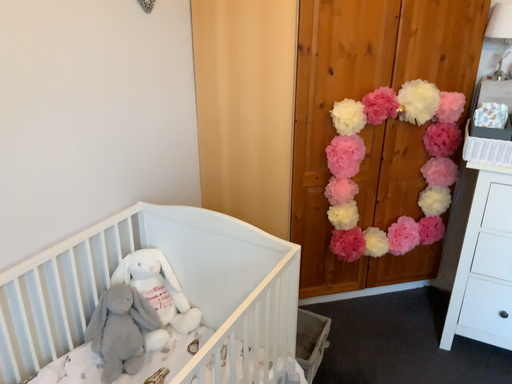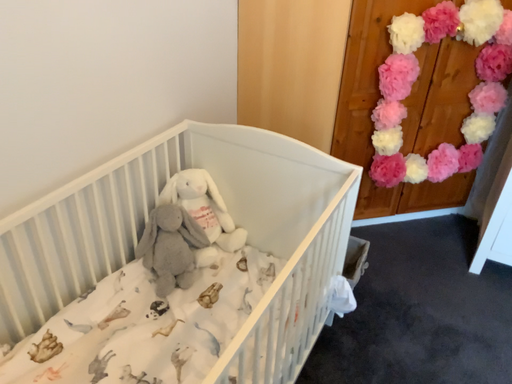
Question: How did the camera likely rotate when shooting the video?

Choices:
 (A) rotated upward
 (B) rotated downward

Answer: (B)